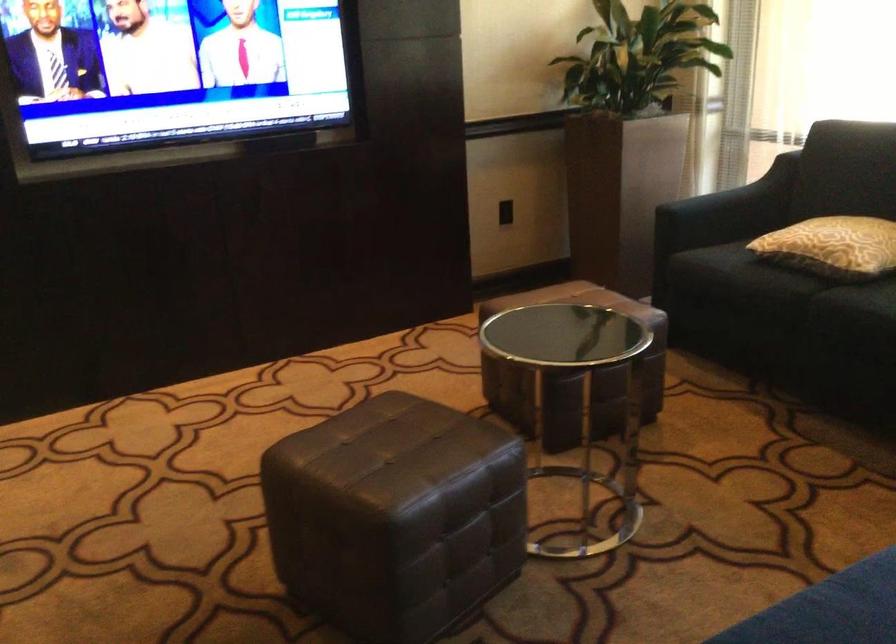
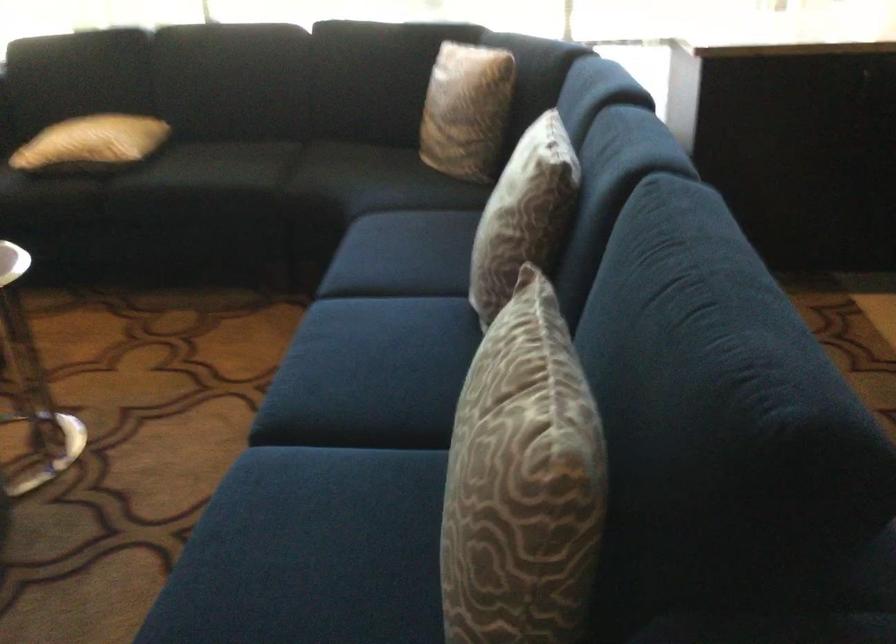
Question: The camera is either moving clockwise (left) or counter-clockwise (right) around the object. The first image is from the beginning of the video and the second image is from the end. Is the camera moving left or right when shooting the video?

Choices:
 (A) Left
 (B) Right

Answer: (A)